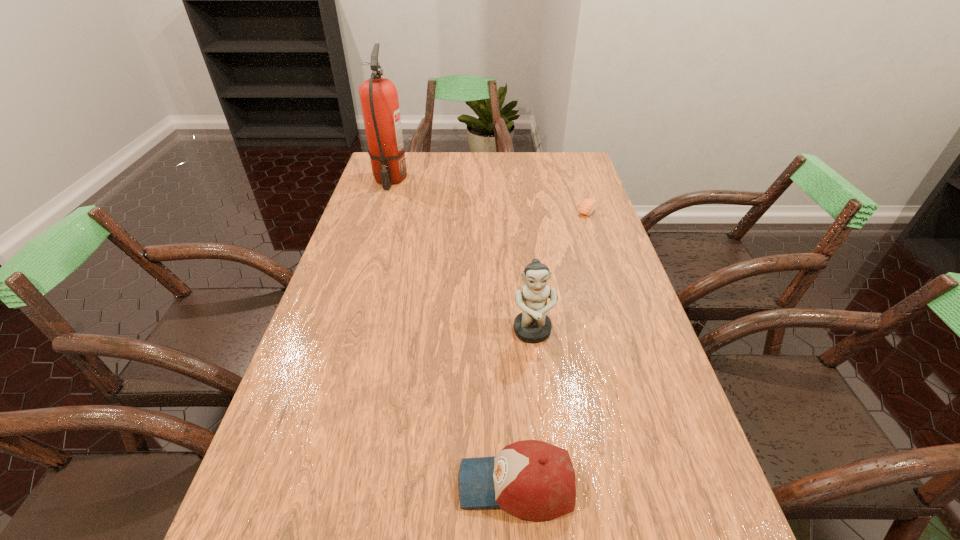
Identify the location of the farthest object. The width and height of the screenshot is (960, 540). (379, 98).

You are a GUI agent. You are given a task and a screenshot of the screen. Output one action in this format:
    pyautogui.click(x=<x>, y=<y>)
    Task: Click on the tallest object
    The height and width of the screenshot is (540, 960).
    Given the screenshot: What is the action you would take?
    pyautogui.click(x=379, y=98)

Where is `the second nearest object`? The height and width of the screenshot is (540, 960). the second nearest object is located at coordinates (532, 325).

You are a GUI agent. You are given a task and a screenshot of the screen. Output one action in this format:
    pyautogui.click(x=<x>, y=<y>)
    Task: Click on the second tallest object
    
    Given the screenshot: What is the action you would take?
    pyautogui.click(x=532, y=325)

Identify the location of baseball cap. (533, 480).

Find the location of a particular element. This screenshot has height=540, width=960. the second shortest object is located at coordinates (533, 480).

Find the location of a particular element. The width and height of the screenshot is (960, 540). sushi is located at coordinates (588, 205).

Where is `the shortest object`? The width and height of the screenshot is (960, 540). the shortest object is located at coordinates (588, 205).

I want to click on vacant area situated 0.170m on the nozzle of the farthest object, so click(x=376, y=222).

Locate an element on the screen. The image size is (960, 540). vacant area located on the front-facing side of the third shortest object is located at coordinates (544, 433).